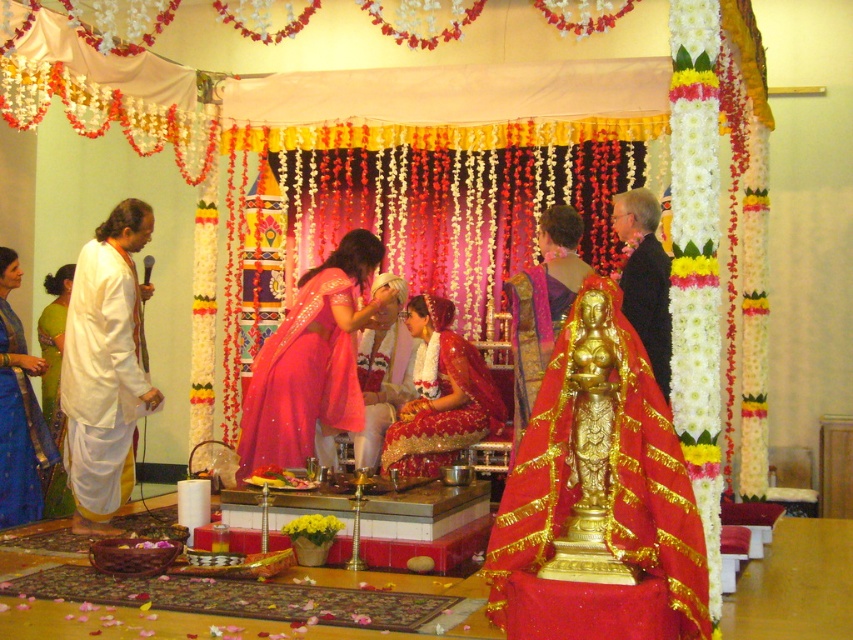
Is point (140, 378) positioned before point (412, 461)?

Yes.

This screenshot has width=853, height=640. Describe the element at coordinates (102, 378) in the screenshot. I see `white cotton robe at left` at that location.

This screenshot has height=640, width=853. Identify the location of white cotton robe at left. (102, 378).

Can you confirm if matte red saree at center is positioned to the left of gold metallic statue at center?

Yes, matte red saree at center is to the left of gold metallic statue at center.

Does matte red saree at center have a lesser height compared to gold metallic statue at center?

No.

The width and height of the screenshot is (853, 640). What do you see at coordinates (440, 396) in the screenshot?
I see `matte red saree at center` at bounding box center [440, 396].

Identify the location of matte red saree at center. This screenshot has width=853, height=640. (440, 396).

Which is behind, point (439, 330) or point (32, 497)?

Positioned behind is point (439, 330).

Is point (480, 412) in front of point (27, 376)?

No.

Between point (436, 442) and point (12, 381), which one is positioned behind?

The point (436, 442) is behind.

Locate an element on the screen. The height and width of the screenshot is (640, 853). matte red saree at center is located at coordinates (440, 396).